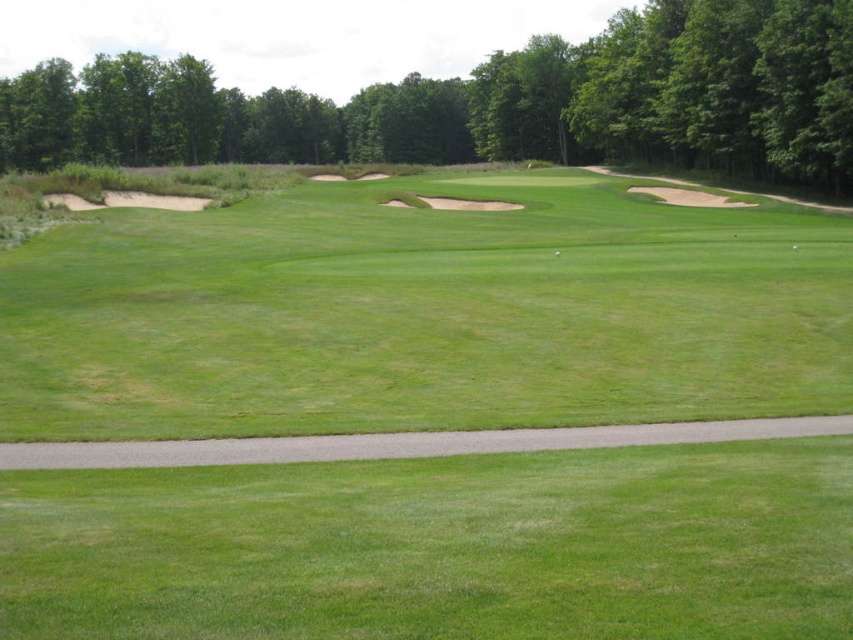
Between green leafy tree at upper center and white matte golf ball at center, which one has more height?

With more height is green leafy tree at upper center.

Between point (26, 129) and point (558, 252), which one is positioned behind?

The point (26, 129) is more distant.

Between point (659, 67) and point (556, 253), which one is positioned in front?

Positioned in front is point (556, 253).

This screenshot has width=853, height=640. I want to click on green leafy tree at upper center, so click(490, 104).

Does green grassy fairway at center appear on the right side of green leafy tree at upper center?

Indeed, green grassy fairway at center is positioned on the right side of green leafy tree at upper center.

Does green grassy fairway at center have a larger size compared to green leafy tree at upper center?

No, green grassy fairway at center is not bigger than green leafy tree at upper center.

Is point (637, 550) positioned before point (757, 170)?

Yes, it is in front of point (757, 170).

Locate an element on the screen. The image size is (853, 640). green grassy fairway at center is located at coordinates (424, 314).

From the picture: Is green grassy fairway at center smaller than white matte golf ball at center?

Incorrect, green grassy fairway at center is not smaller in size than white matte golf ball at center.

Who is more distant from viewer, [160,342] or [560,252]?

Point [560,252]

What do you see at coordinates (424, 314) in the screenshot? The height and width of the screenshot is (640, 853). I see `green grassy fairway at center` at bounding box center [424, 314].

What are the coordinates of `green grassy fairway at center` in the screenshot? It's located at (424, 314).